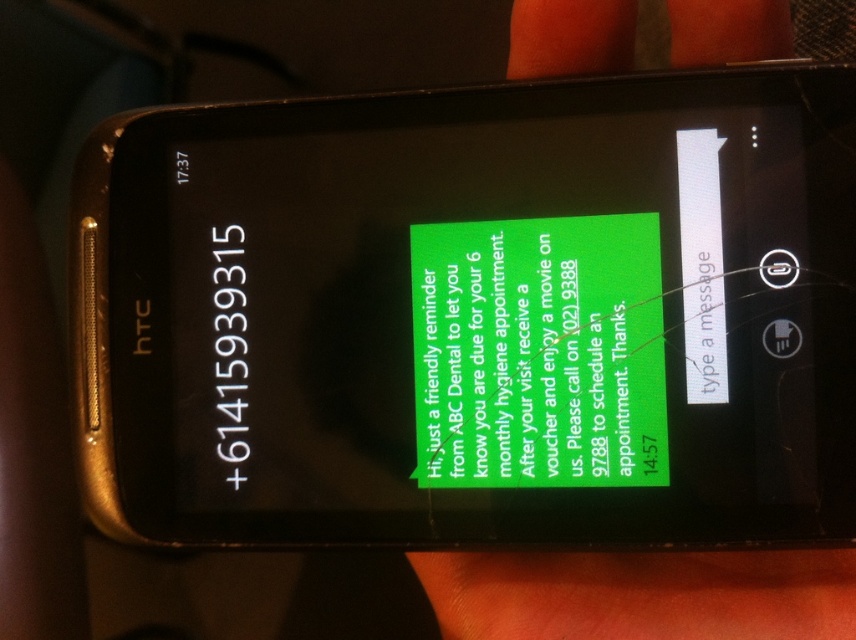
Question: Does green matte text message at center appear on the left side of white matte text at upper right?

Choices:
 (A) no
 (B) yes

Answer: (B)

Question: Is black plastic smartphone at center behind white glossy phone number at upper left?

Choices:
 (A) yes
 (B) no

Answer: (B)

Question: Which point is closer to the camera?

Choices:
 (A) white glossy phone number at upper left
 (B) green matte text message at center
 (C) white matte text at upper right
 (D) black plastic smartphone at center

Answer: (D)

Question: Can you confirm if black plastic smartphone at center is positioned to the right of green matte text message at center?

Choices:
 (A) no
 (B) yes

Answer: (A)

Question: Which of these objects is positioned farthest from the white matte text at upper right?

Choices:
 (A) green matte text message at center
 (B) white glossy phone number at upper left
 (C) black plastic smartphone at center

Answer: (B)

Question: Which of the following is the farthest from the observer?

Choices:
 (A) black plastic smartphone at center
 (B) white glossy phone number at upper left
 (C) white matte text at upper right
 (D) green matte text message at center

Answer: (B)